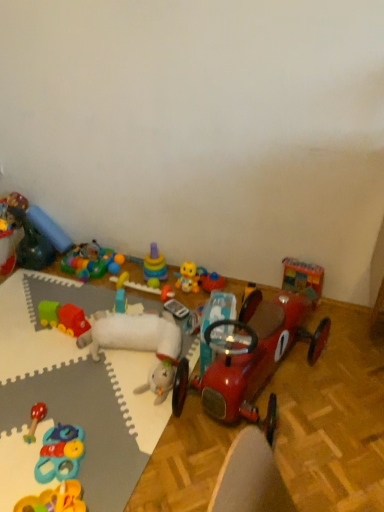
Locate an element on the screen. The image size is (384, 512). vacant space that's between rubberized plastic toy at lower left, placed as the 7th toy when sorted from left to right, and wooden rattle at lower left, positioned as the 6th toy in left-to-right order is located at coordinates (39, 448).